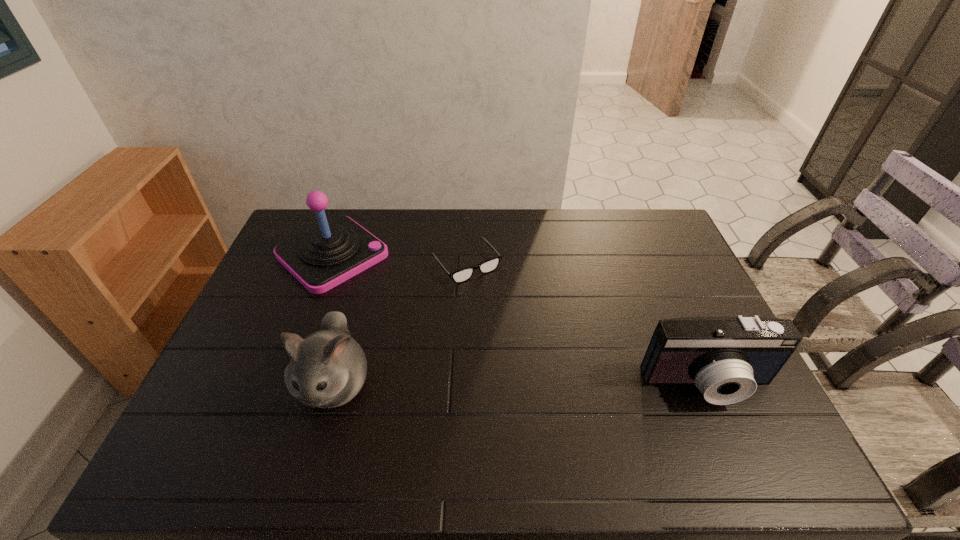
You are a GUI agent. You are given a task and a screenshot of the screen. Output one action in this format:
    pyautogui.click(x=<x>, y=<y>)
    Task: Click on the vacant space on the desktop that is between the hamster and the rightmost object and is positioned on the front-facing side of the third object from left to right
    This screenshot has height=540, width=960.
    Given the screenshot: What is the action you would take?
    pyautogui.click(x=562, y=384)

This screenshot has height=540, width=960. What are the coordinates of `free spot on the desktop that is between the hamster and the camcorder and is positioned forward from the base of the joystick` in the screenshot? It's located at (484, 384).